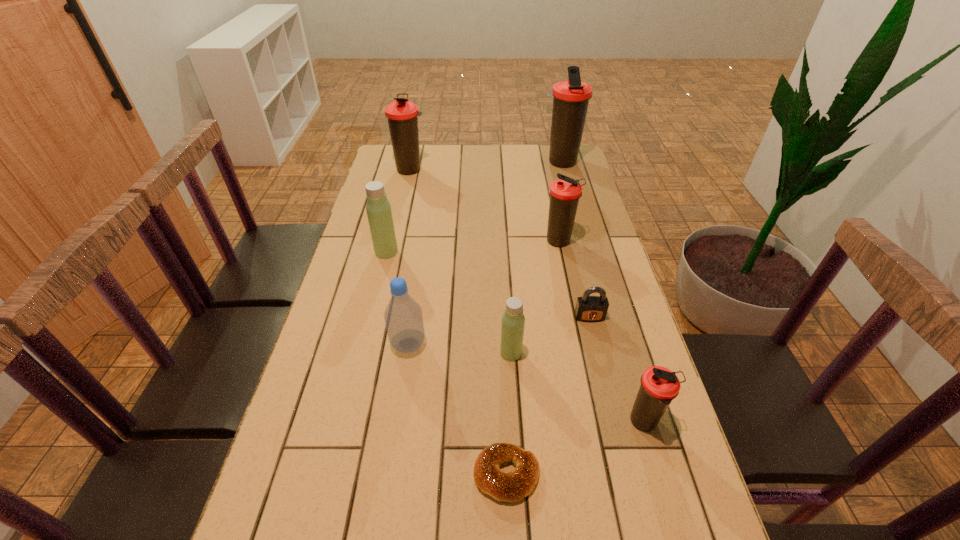
Where is `the right light thermos bottle`? Image resolution: width=960 pixels, height=540 pixels. the right light thermos bottle is located at coordinates (513, 320).

This screenshot has width=960, height=540. Identify the location of the smaller light thermos bottle. (513, 320).

In order to click on gray padlock in this screenshot , I will do `click(588, 308)`.

Find the location of a particular element. This screenshot has width=960, height=540. the fifth farthest object is located at coordinates (588, 308).

The image size is (960, 540). In order to click on brown bagel in this screenshot , I will do `click(510, 487)`.

Locate an element on the screen. This screenshot has width=960, height=540. bagel is located at coordinates (510, 487).

In order to click on vacant space located on the front of the tallest object in this screenshot , I will do `click(569, 194)`.

The height and width of the screenshot is (540, 960). Find the location of `vacant space situated on the right of the leftmost brown thermos bottle`. vacant space situated on the right of the leftmost brown thermos bottle is located at coordinates (443, 170).

Identify the location of free space located on the right of the third biggest brown thermos bottle. The image size is (960, 540). (591, 242).

This screenshot has width=960, height=540. I want to click on blank space located on the back of the farther light thermos bottle, so click(402, 185).